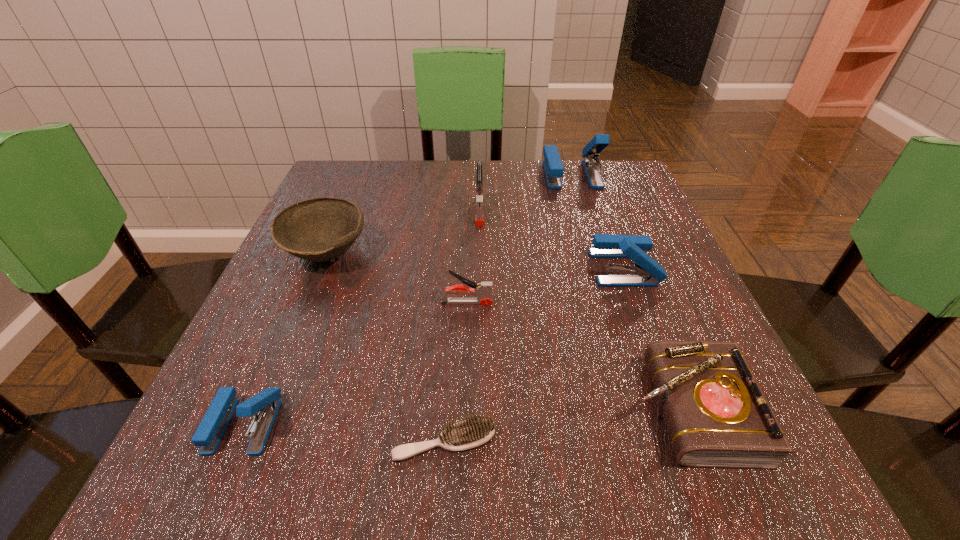
I want to click on free space in the image that satisfies the following two spatial constraints: 1. on the front side of the nearest stapler; 2. on the left side of the scrubbing brush, so click(x=236, y=441).

The image size is (960, 540). What are the coordinates of `free point that satisfies the following two spatial constraints: 1. on the front side of the farthest object; 2. on the left side of the second shortest object` in the screenshot? It's located at (645, 409).